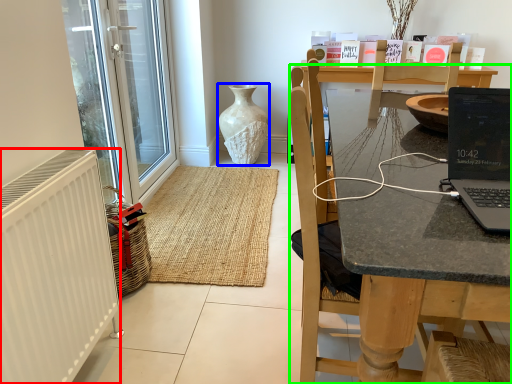
Question: Considering the real-world distances, which object is closest to radiator (highlighted by a red box)? vase (highlighted by a blue box) or chair (highlighted by a green box).

Choices:
 (A) vase
 (B) chair

Answer: (B)